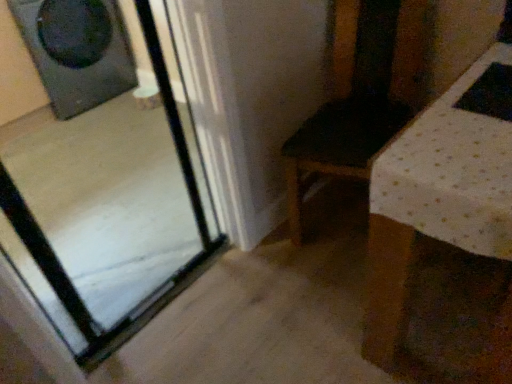
Find the location of a particular element. transparent glass door at left is located at coordinates (104, 173).

What is the approximate height of transparent glass door at left?

The height of transparent glass door at left is 3.67 feet.

Describe the element at coordinates (104, 173) in the screenshot. The image size is (512, 384). I see `transparent glass door at left` at that location.

Locate an element on the screen. matte black speaker at upper left is located at coordinates (77, 51).

Describe the element at coordinates (77, 51) in the screenshot. The image size is (512, 384). I see `matte black speaker at upper left` at that location.

The height and width of the screenshot is (384, 512). Find the location of `transparent glass door at left`. transparent glass door at left is located at coordinates tap(104, 173).

Does transparent glass door at left appear on the right side of matte black speaker at upper left?

Correct, you'll find transparent glass door at left to the right of matte black speaker at upper left.

Is transparent glass door at left in front of or behind matte black speaker at upper left in the image?

Visually, transparent glass door at left is located in front of matte black speaker at upper left.

Which point is more distant from viewer, (111, 224) or (133, 74)?

The point (133, 74) is farther from the camera.

From the image's perspective, is transparent glass door at left beneath matte black speaker at upper left?

Indeed, from the image's perspective, transparent glass door at left is shown beneath matte black speaker at upper left.

From a real-world perspective, between transparent glass door at left and matte black speaker at upper left, who is vertically higher?

transparent glass door at left is physically above.

Consider the image. Does transparent glass door at left have a greater width compared to matte black speaker at upper left?

No.

Is transparent glass door at left shorter than matte black speaker at upper left?

In fact, transparent glass door at left may be taller than matte black speaker at upper left.

Is transparent glass door at left bigger or smaller than matte black speaker at upper left?

transparent glass door at left is smaller than matte black speaker at upper left.

Is transparent glass door at left completely or partially outside of matte black speaker at upper left?

That's correct, transparent glass door at left is outside of matte black speaker at upper left.

Is transparent glass door at left next to matte black speaker at upper left?

They are not placed beside each other.

Does transparent glass door at left turn towards matte black speaker at upper left?

Yes, transparent glass door at left is facing matte black speaker at upper left.

What's the angular difference between transparent glass door at left and matte black speaker at upper left's facing directions?

transparent glass door at left and matte black speaker at upper left are facing 179 degrees away from each other.

How distant is transparent glass door at left from matte black speaker at upper left?

transparent glass door at left is 13.98 inches from matte black speaker at upper left.

I want to click on speaker lying above the transparent glass door at left (from the image's perspective), so coord(77,51).

Is matte black speaker at upper left to the left or to the right of transparent glass door at left in the image?

Clearly, matte black speaker at upper left is on the left of transparent glass door at left in the image.

Considering the positions of objects matte black speaker at upper left and transparent glass door at left in the image provided, who is behind, matte black speaker at upper left or transparent glass door at left?

matte black speaker at upper left is further away from the camera.

Considering the points (134, 73) and (94, 276), which point is behind, point (134, 73) or point (94, 276)?

Point (134, 73)

From the image's perspective, which one is positioned higher, matte black speaker at upper left or transparent glass door at left?

matte black speaker at upper left, from the image's perspective.

From a real-world perspective, is matte black speaker at upper left positioned over transparent glass door at left based on gravity?

No, from a real-world perspective, matte black speaker at upper left is not on top of transparent glass door at left.

Considering the relative sizes of matte black speaker at upper left and transparent glass door at left in the image provided, is matte black speaker at upper left wider than transparent glass door at left?

Yes, matte black speaker at upper left is wider than transparent glass door at left.

Who is taller, matte black speaker at upper left or transparent glass door at left?

transparent glass door at left is taller.

In terms of size, does matte black speaker at upper left appear bigger or smaller than transparent glass door at left?

Considering their sizes, matte black speaker at upper left takes up more space than transparent glass door at left.

Can transparent glass door at left be found inside matte black speaker at upper left?

Definitely not — transparent glass door at left is not inside matte black speaker at upper left.

Are matte black speaker at upper left and transparent glass door at left located far from each other?

They are positioned close to each other.

Is transparent glass door at left at the back of matte black speaker at upper left?

No, matte black speaker at upper left is not facing away from transparent glass door at left.

Locate an element on the screen. The width and height of the screenshot is (512, 384). glass door on the right side of matte black speaker at upper left is located at coordinates (104, 173).

Identify the location of glass door on the right of matte black speaker at upper left. (104, 173).

I want to click on speaker above the transparent glass door at left (from the image's perspective), so click(x=77, y=51).